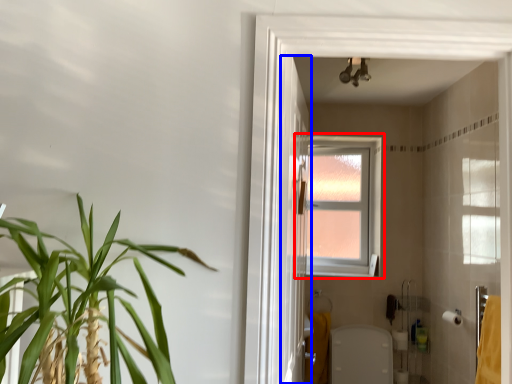
Question: Which of the following is the farthest to the observer, window (highlighted by a red box) or screen door (highlighted by a blue box)?

Choices:
 (A) window
 (B) screen door

Answer: (A)